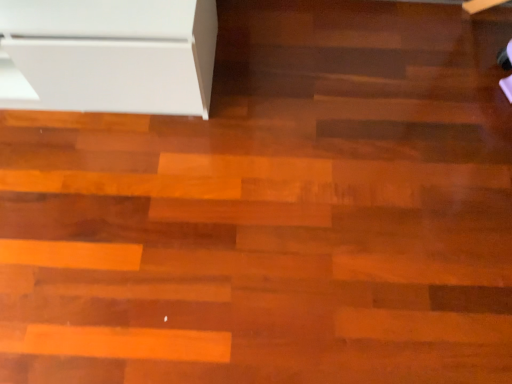
Image resolution: width=512 pixels, height=384 pixels. I want to click on vacant space in front of white glossy cabinet at upper left, so click(113, 215).